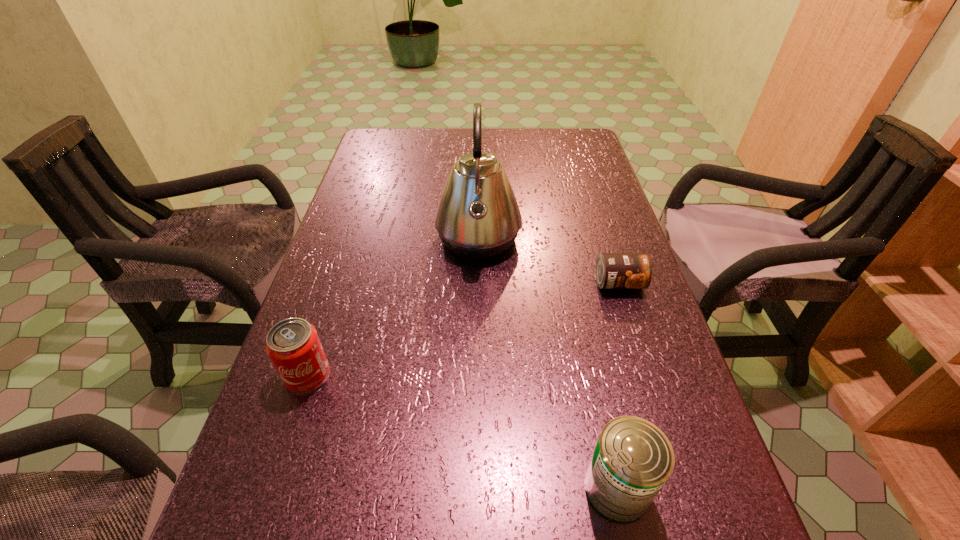
Find the location of a particular element. the second object from left to right is located at coordinates (477, 217).

Image resolution: width=960 pixels, height=540 pixels. What are the coordinates of `the tallest object` in the screenshot? It's located at (477, 217).

You are a GUI agent. You are given a task and a screenshot of the screen. Output one action in this format:
    pyautogui.click(x=<x>, y=<y>)
    Task: Click on the third object from left to right
    
    Given the screenshot: What is the action you would take?
    pyautogui.click(x=633, y=459)

Where is `the second can from right to left`? This screenshot has height=540, width=960. the second can from right to left is located at coordinates (633, 459).

The height and width of the screenshot is (540, 960). What are the coordinates of `the second nearest can` in the screenshot? It's located at (293, 345).

At what (x,y) coordinates should I click in order to perform the action: click on the second nearest object. Please return your answer as a coordinate pair (x, y). This screenshot has height=540, width=960. Looking at the image, I should click on (293, 345).

Locate an element on the screen. the shortest can is located at coordinates (613, 270).

Find the location of `the farthest can`. the farthest can is located at coordinates (613, 270).

The image size is (960, 540). I want to click on free point located 0.160m from the spout of the tallest object, so click(583, 239).

At what (x,y) coordinates should I click in order to perform the action: click on vacant space situated 0.260m on the left of the nearest can. Please return your answer as a coordinate pair (x, y). Looking at the image, I should click on (420, 488).